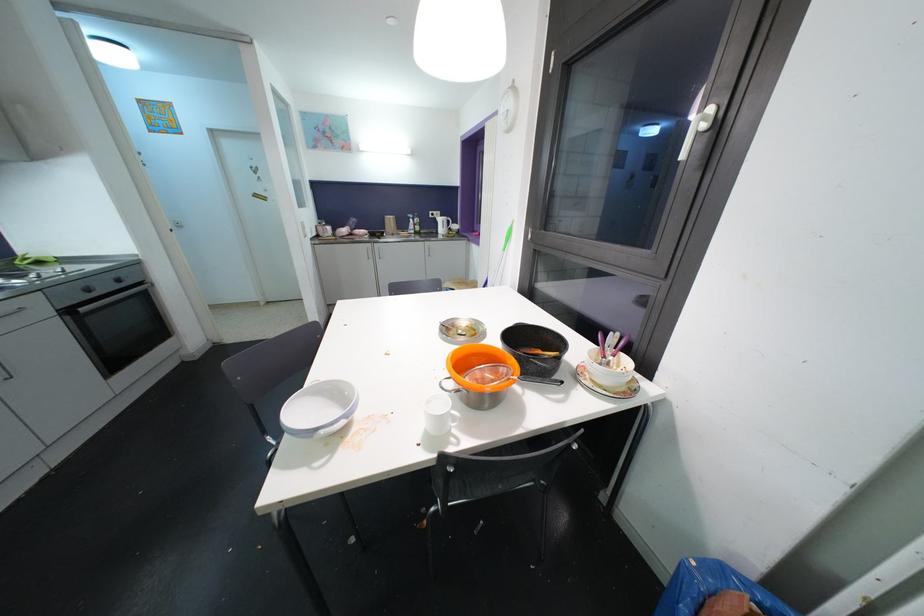
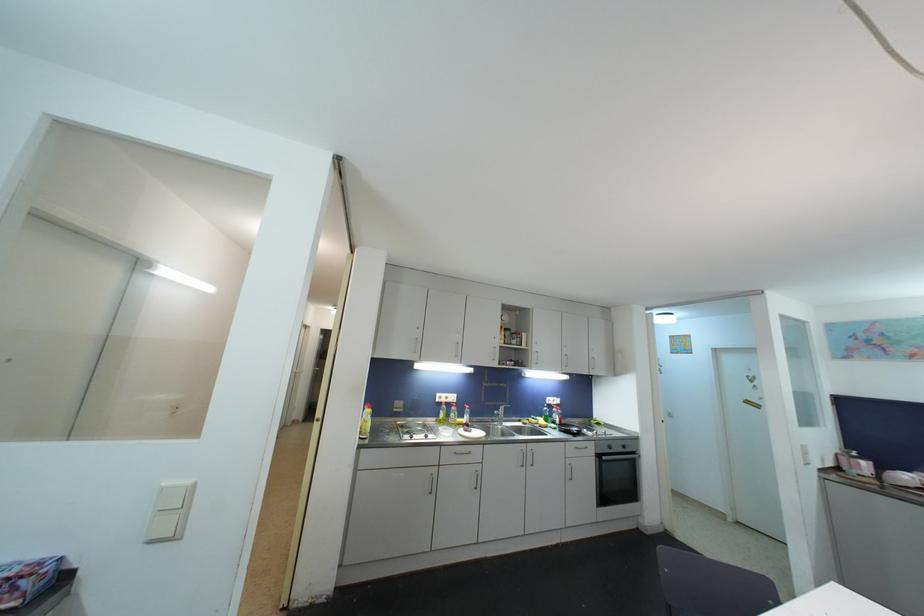
The point at (116, 278) is marked in the first image. Where is the corresponding point in the second image?

(625, 445)